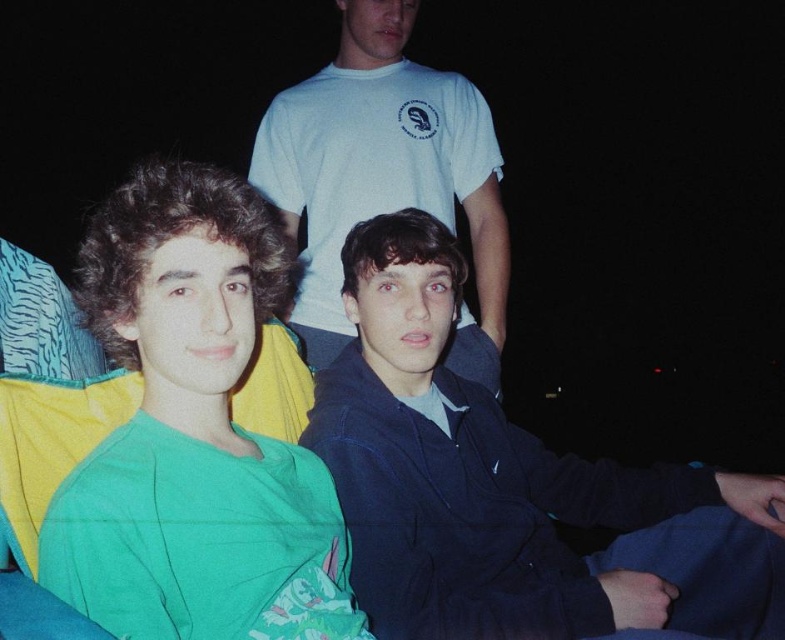
Question: Can you confirm if green matte shirt at center is positioned to the left of white t-shirt at upper center?

Choices:
 (A) yes
 (B) no

Answer: (A)

Question: Which object appears farthest from the camera in this image?

Choices:
 (A) green matte shirt at center
 (B) white t-shirt at upper center

Answer: (B)

Question: Which of the following is the closest to the observer?

Choices:
 (A) white t-shirt at upper center
 (B) dark blue jacket at center

Answer: (B)

Question: Is dark blue jacket at center to the right of white t-shirt at upper center from the viewer's perspective?

Choices:
 (A) no
 (B) yes

Answer: (B)

Question: Which of the following is the closest to the observer?

Choices:
 (A) green matte shirt at center
 (B) dark blue jacket at center
 (C) white t-shirt at upper center

Answer: (A)

Question: Can you confirm if dark blue jacket at center is thinner than white t-shirt at upper center?

Choices:
 (A) yes
 (B) no

Answer: (B)